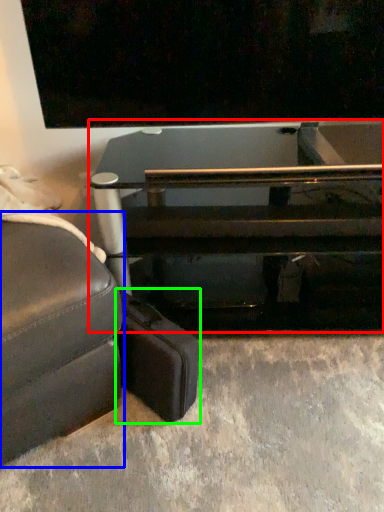
Question: Considering the real-world distances, which object is closest to table (highlighted by a red box)? studio couch (highlighted by a blue box) or luggage (highlighted by a green box).

Choices:
 (A) studio couch
 (B) luggage

Answer: (B)